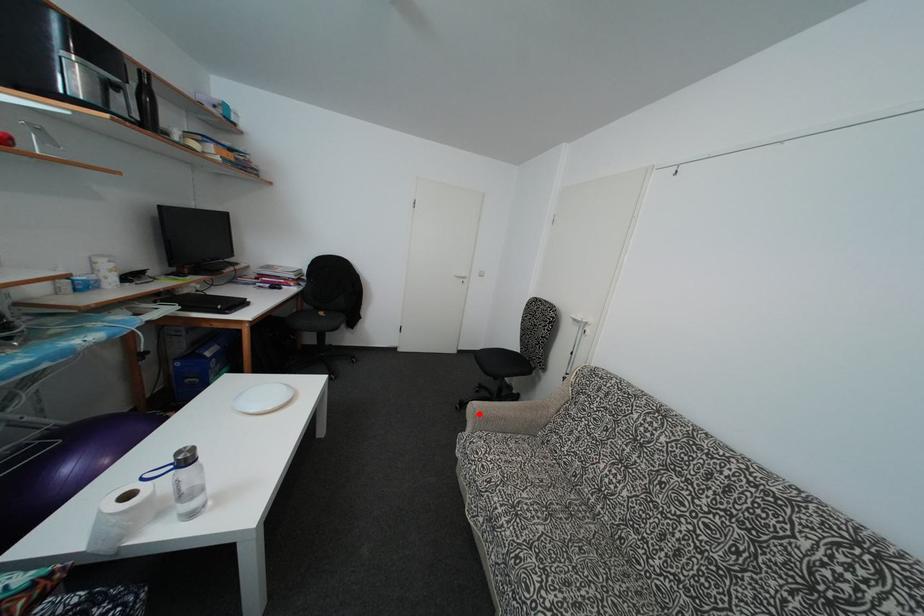
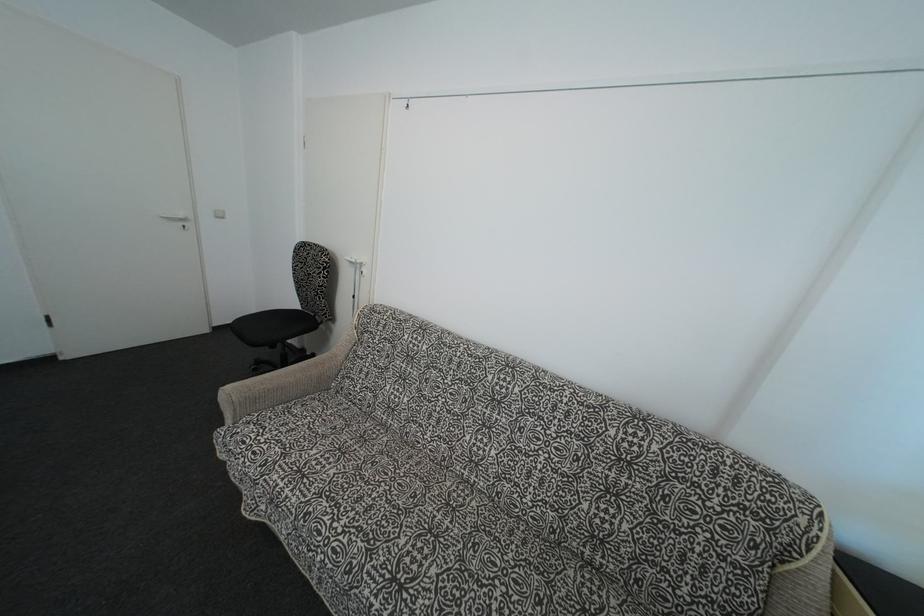
Where in the second image is the point corresponding to the highlighted location from the first image?

(235, 399)